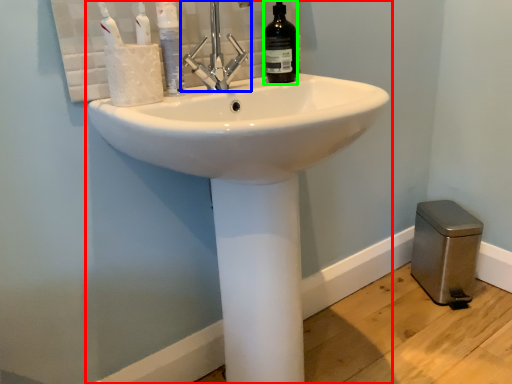
Question: Considering the real-world distances, which object is farthest from sink (highlighted by a red box)? tap (highlighted by a blue box) or bottle (highlighted by a green box)?

Choices:
 (A) tap
 (B) bottle

Answer: (B)